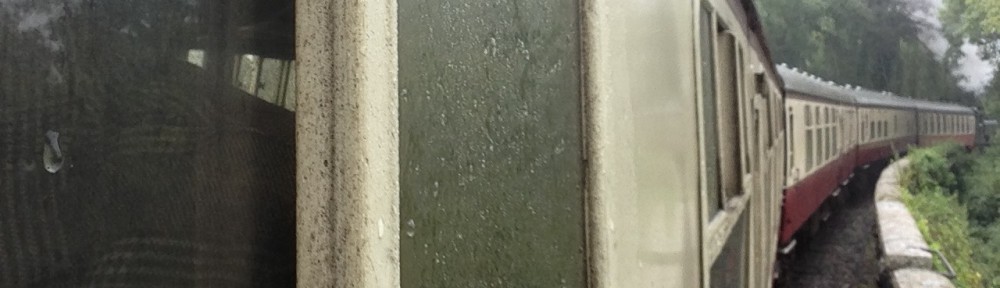
Identify the location of concrete wall. The width and height of the screenshot is (1000, 288). (x=902, y=231), (x=922, y=281), (x=892, y=175), (x=912, y=153).